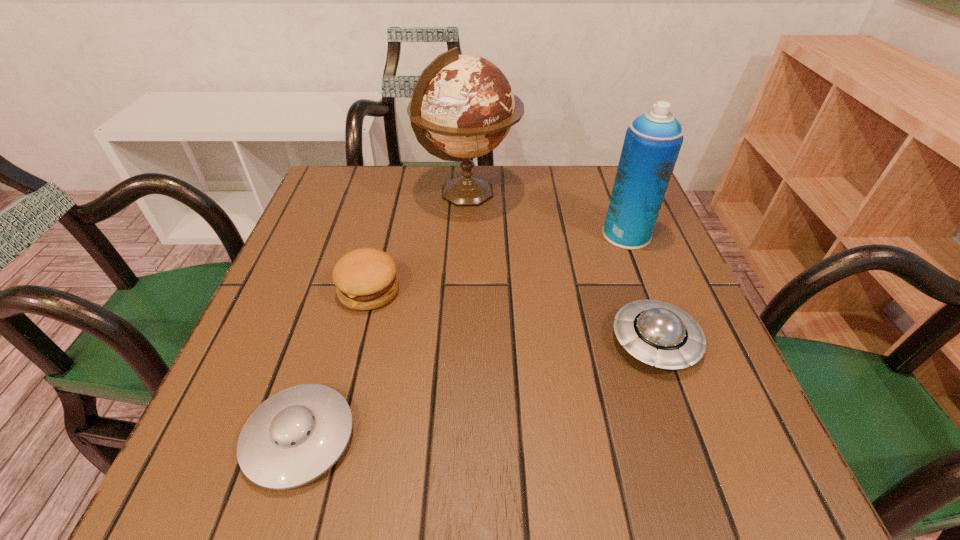
This screenshot has height=540, width=960. Find the location of `vacant space that satisfies the following two spatial constraints: 1. on the front of the second tallest object showing Asia; 2. on the left side of the globe`. vacant space that satisfies the following two spatial constraints: 1. on the front of the second tallest object showing Asia; 2. on the left side of the globe is located at coordinates (467, 234).

What are the coordinates of `vacant region that satisfies the following two spatial constraints: 1. on the back side of the fourth shortest object; 2. on the front of the third object from right to left showing Asia` in the screenshot? It's located at (611, 193).

Image resolution: width=960 pixels, height=540 pixels. In order to click on free space in the image that satisfies the following two spatial constraints: 1. on the front of the third object from right to left showing Asia; 2. on the left side of the taller saucer in this screenshot , I will do `click(463, 341)`.